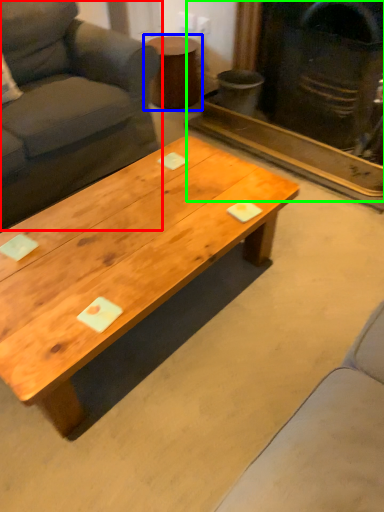
Question: Based on their relative distances, which object is farther from studio couch (highlighted by a red box)? Choose from side table (highlighted by a blue box) and fireplace (highlighted by a green box).

Choices:
 (A) side table
 (B) fireplace

Answer: (B)